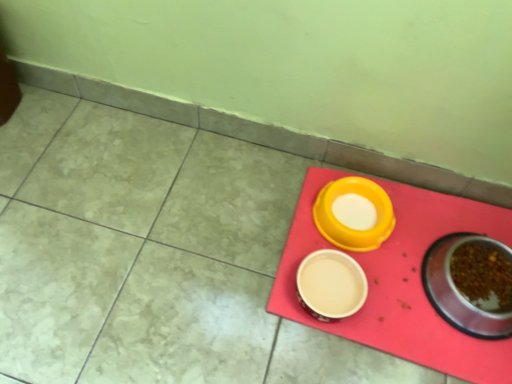
The height and width of the screenshot is (384, 512). What are the coordinates of `free space to the right of beige ceramic bowl at center, placed as the 3th tableware when sorted from right to left` in the screenshot? It's located at (406, 302).